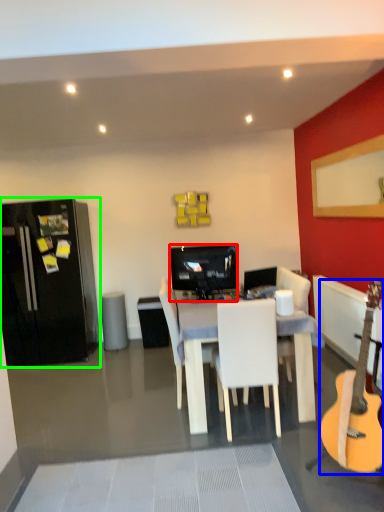
Question: Considering the real-world distances, which object is closest to television (highlighted by a red box)? guitar (highlighted by a blue box) or refrigerator (highlighted by a green box).

Choices:
 (A) guitar
 (B) refrigerator

Answer: (B)